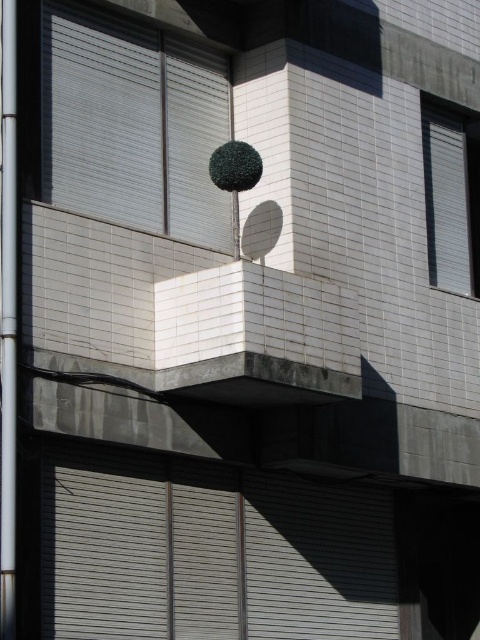
Does matte gray window at upper left appear on the right side of white matte window at upper right?

In fact, matte gray window at upper left is to the left of white matte window at upper right.

Between matte gray window at upper left and white matte window at upper right, which one appears on the right side from the viewer's perspective?

Positioned to the right is white matte window at upper right.

Image resolution: width=480 pixels, height=640 pixels. What do you see at coordinates (132, 124) in the screenshot?
I see `matte gray window at upper left` at bounding box center [132, 124].

At what (x,y) coordinates should I click in order to perform the action: click on matte gray window at upper left. Please return your answer as a coordinate pair (x, y). The height and width of the screenshot is (640, 480). Looking at the image, I should click on (132, 124).

Does matte gray window at upper left appear on the right side of metallic pole at left?

Indeed, matte gray window at upper left is positioned on the right side of metallic pole at left.

Who is taller, matte gray window at upper left or metallic pole at left?

metallic pole at left

Identify the location of matte gray window at upper left. (132, 124).

Locate an element on the screen. matte gray window at upper left is located at coordinates (132, 124).

Locate an element on the screen. metallic pole at left is located at coordinates (9, 323).

Between metallic pole at left and white matte window at upper right, which one is positioned higher?

white matte window at upper right

At what (x,y) coordinates should I click in order to perform the action: click on metallic pole at left. Please return your answer as a coordinate pair (x, y). The image size is (480, 640). Looking at the image, I should click on (9, 323).